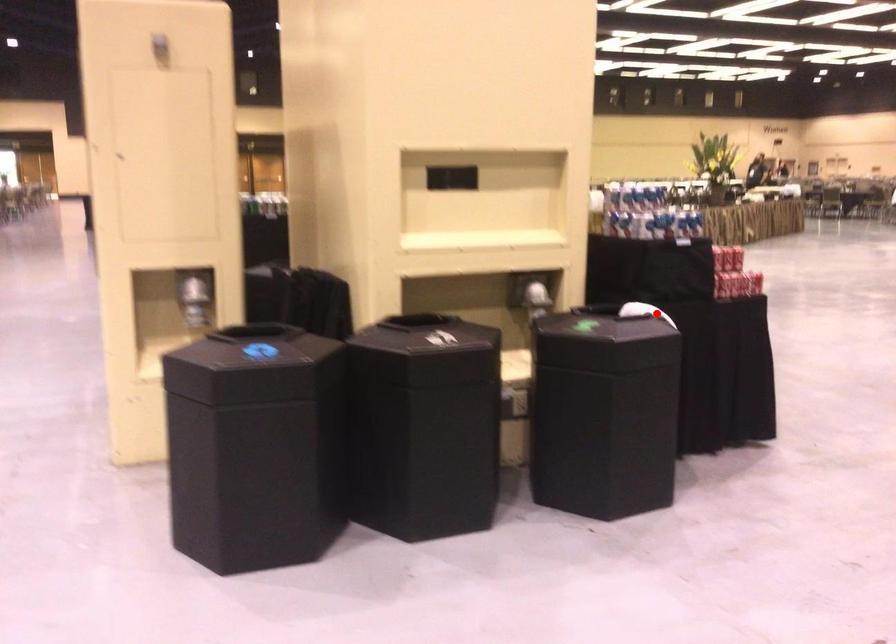
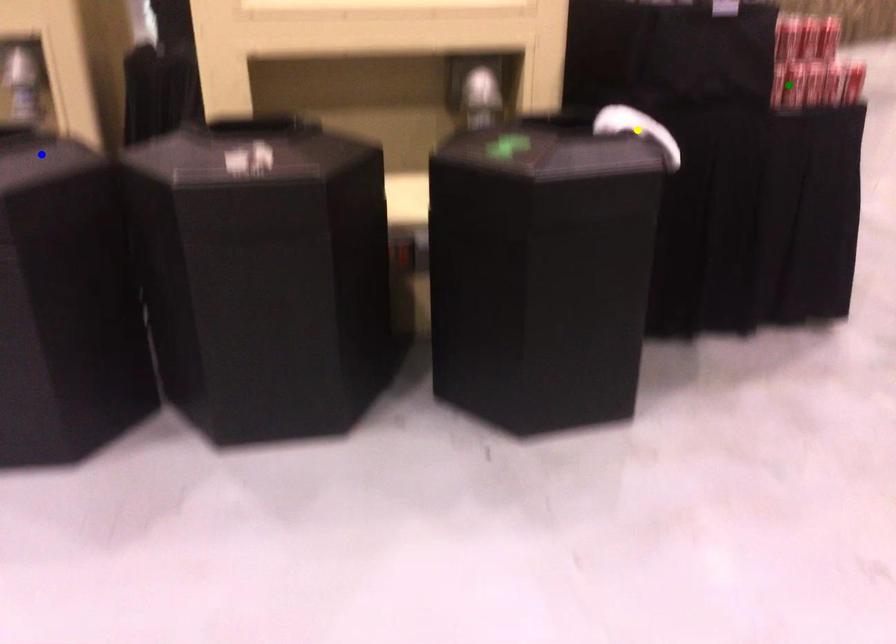
Question: I am providing you with two images of the same scene from different viewpoints. A red point is marked on the first image. You are given multiple points on the second image. In image 2, which mark is for the same physical point as the one in image 1?

Choices:
 (A) blue point
 (B) yellow point
 (C) green point

Answer: (B)